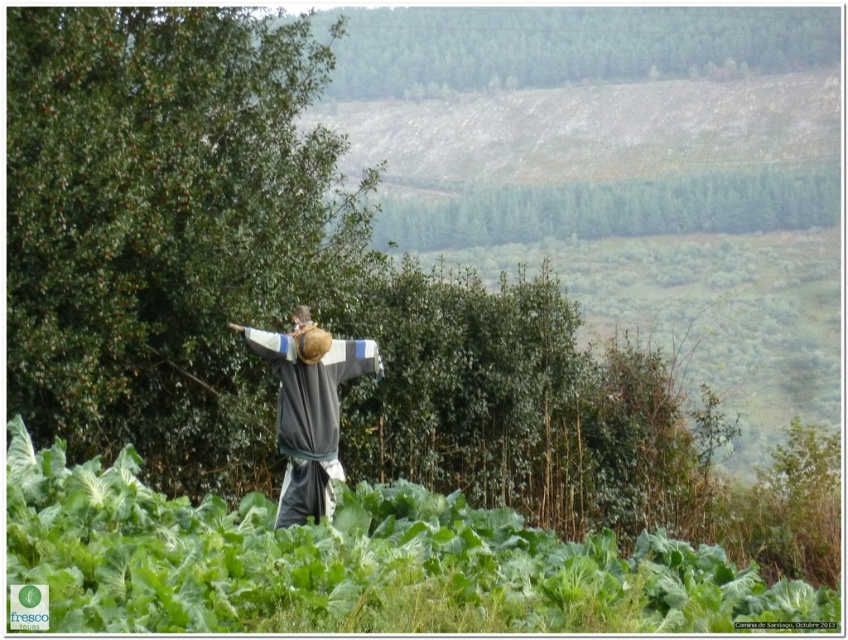
You are standing in the field where the scarecrow is located. You notice two green leafy trees in the background. Which tree is closer to you, the green leafy tree at left or the green leafy tree at upper center?

The green leafy tree at left is closer to you because it is in front of the green leafy tree at upper center.

You are standing at the point marked as point (165, 227) in the image. Based on the scene description, what object is located at that point?

The point (165, 227) corresponds to a green leafy tree at left.

You are a bird flying over a rural area and see the gray fabric scarecrow at center and the green leafy tree at left. Which object is closer to the foreground?

The green leafy tree at left is closer to the foreground because the gray fabric scarecrow at center is positioned behind it.